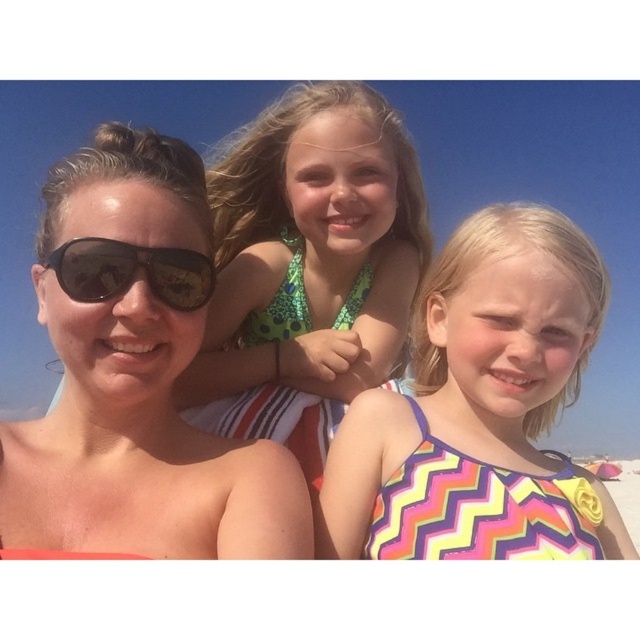
Based on the photo, between matte black sunglasses at left and multicolored zigzag swimsuit at center, which one has more height?

Standing taller between the two is multicolored zigzag swimsuit at center.

Between matte black sunglasses at left and multicolored zigzag swimsuit at center, which one is positioned lower?

matte black sunglasses at left is below.

What do you see at coordinates (134, 376) in the screenshot?
I see `matte black sunglasses at left` at bounding box center [134, 376].

Where is `matte black sunglasses at left`? Image resolution: width=640 pixels, height=640 pixels. matte black sunglasses at left is located at coordinates (134, 376).

Does multicolored zigzag swimsuit at center appear on the left side of green polka dot swimsuit at center?

In fact, multicolored zigzag swimsuit at center is to the right of green polka dot swimsuit at center.

This screenshot has height=640, width=640. Find the location of `multicolored zigzag swimsuit at center`. multicolored zigzag swimsuit at center is located at coordinates (481, 408).

Identify the location of multicolored zigzag swimsuit at center. The width and height of the screenshot is (640, 640). (481, 408).

Locate an element on the screen. The image size is (640, 640). multicolored zigzag swimsuit at center is located at coordinates (481, 408).

Is multicolored zigzag swimsuit at center positioned behind black reflective sunglasses at left?

Yes.

Is point (390, 422) less distant than point (188, 282)?

No.

Is point (513, 310) positioned in front of point (186, 298)?

No, (513, 310) is behind (186, 298).

Image resolution: width=640 pixels, height=640 pixels. In order to click on multicolored zigzag swimsuit at center in this screenshot , I will do `click(481, 408)`.